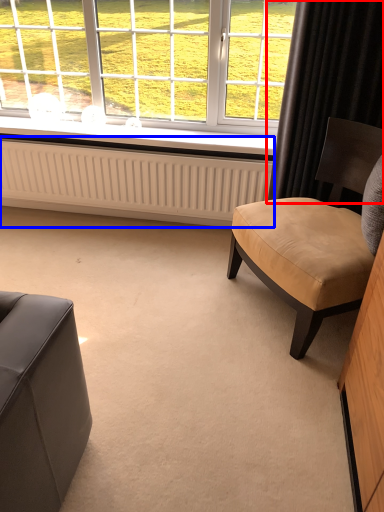
Question: Which point is further to the camera, curtain (highlighted by a red box) or radiator (highlighted by a blue box)?

Choices:
 (A) curtain
 (B) radiator

Answer: (B)